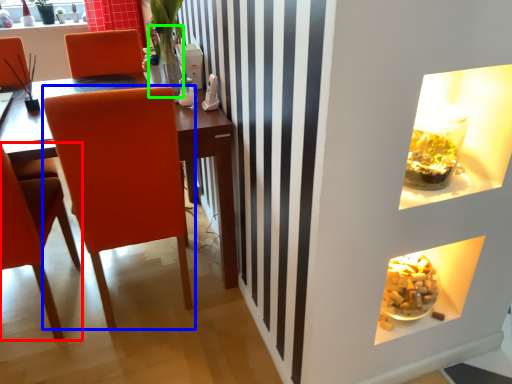
Question: Which object is the farthest from chair (highlighted by a red box)? Choose among these: chair (highlighted by a blue box) or glass vase (highlighted by a green box).

Choices:
 (A) chair
 (B) glass vase

Answer: (B)